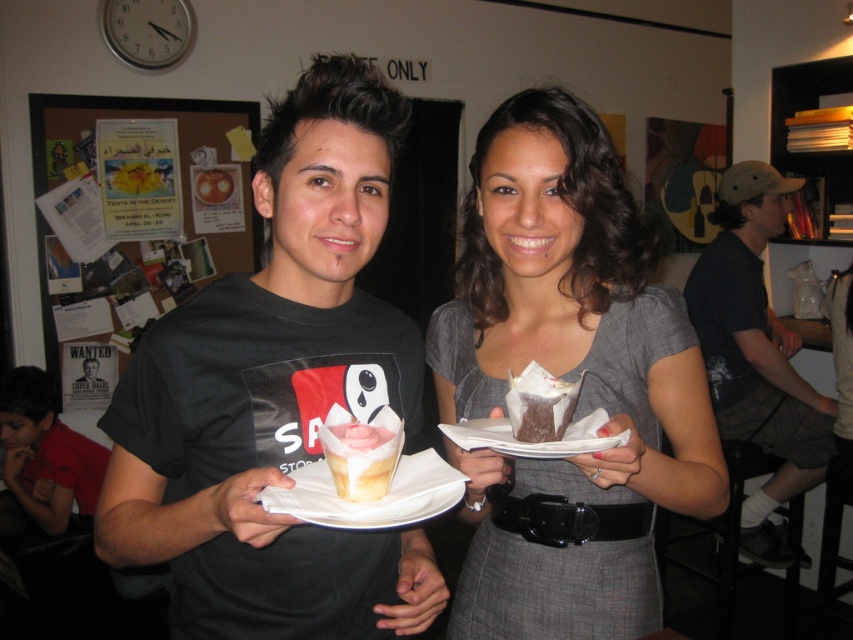
You are standing in the room and want to place a new notice on the bulletin board. However, you notice that the wooden corkboard at upper left is partially blocked by the dark gray shorts at right. Can you still access the entire corkboard to pin your notice?

The wooden corkboard at upper left is located above the dark gray shorts at right, so the lower part of the corkboard might still be accessible above the shorts. However, the area directly behind the shorts may be obstructed.

You are trying to hang a picture frame on the wall behind the wooden corkboard at upper left and the dark gray shorts at right. Which object do you need to move first to access the wall space behind it?

The dark gray shorts at right is behind the wooden corkboard at upper left, so you need to move the wooden corkboard at upper left first to access the wall space behind it.

You are organizing a small party and need to place a matte gray dress at center and a white paper plate at center on a shelf. The shelf has limited space. Which item should you place first to ensure both fit?

The white paper plate at center should be placed first because the matte gray dress at center might be wider than it, so positioning the wider item first ensures both can fit on the shelf.